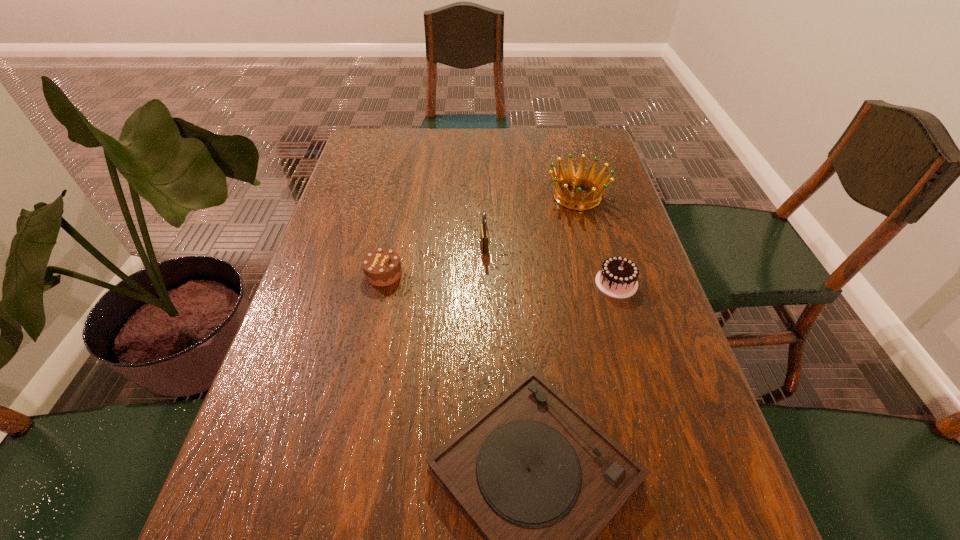
The height and width of the screenshot is (540, 960). I want to click on vacant space that is in between the right chocolate cake and the tallest object, so click(x=550, y=265).

Image resolution: width=960 pixels, height=540 pixels. I want to click on empty space between the shorter chocolate cake and the right chocolate cake, so click(x=500, y=278).

You are a GUI agent. You are given a task and a screenshot of the screen. Output one action in this format:
    pyautogui.click(x=<x>, y=<y>)
    Task: Click on the free space between the tallest object and the leftmost object
    
    Given the screenshot: What is the action you would take?
    pos(434,260)

Where is `unoccupied area between the right chocolate cake and the second farthest object`? This screenshot has width=960, height=540. unoccupied area between the right chocolate cake and the second farthest object is located at coordinates (550, 265).

At what (x,y) coordinates should I click in order to perform the action: click on object identified as the fourth closest to the farthest object. Please return your answer as a coordinate pair (x, y). Looking at the image, I should click on (539, 481).

Identify which object is the third closest to the fourth tallest object. Please provide its 2D coordinates. Your answer should be formatted as a tuple, i.e. [(x, y)], where the tuple contains the x and y coordinates of a point satisfying the conditions above.

[(564, 180)]